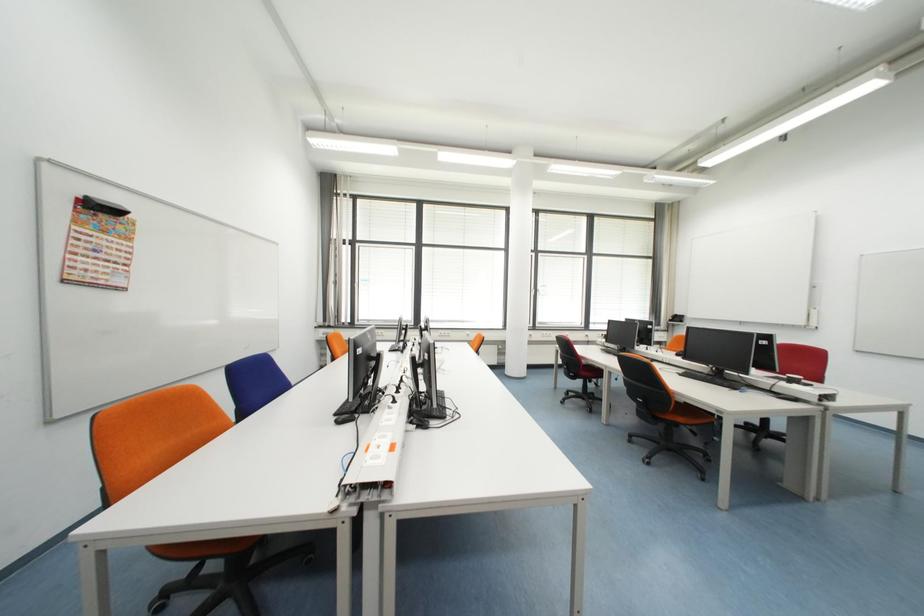
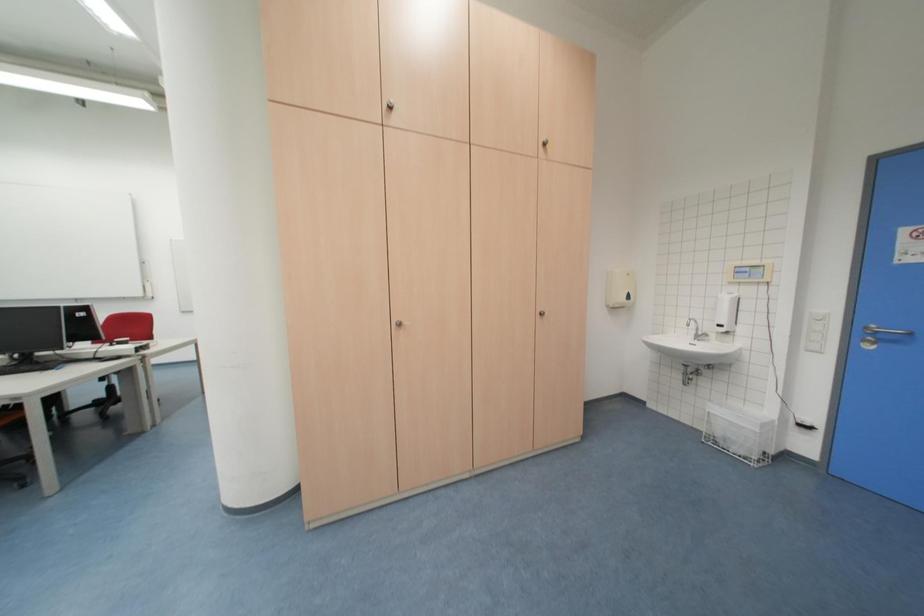
Question: The camera is either moving clockwise (left) or counter-clockwise (right) around the object. The first image is from the beginning of the video and the second image is from the end. Is the camera moving left or right when shooting the video?

Choices:
 (A) Left
 (B) Right

Answer: (A)